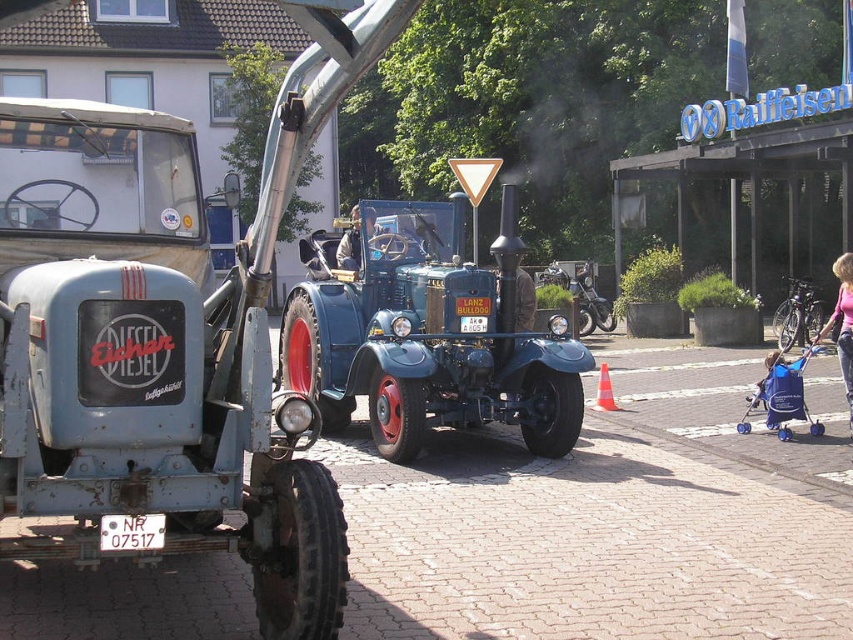
Which of these two, matte blue tow truck at left or blue metallic tractor at center, stands shorter?

With less height is blue metallic tractor at center.

Who is more forward, (248, 387) or (500, 364)?

Point (248, 387) is in front.

The image size is (853, 640). I want to click on matte blue tow truck at left, so click(x=184, y=385).